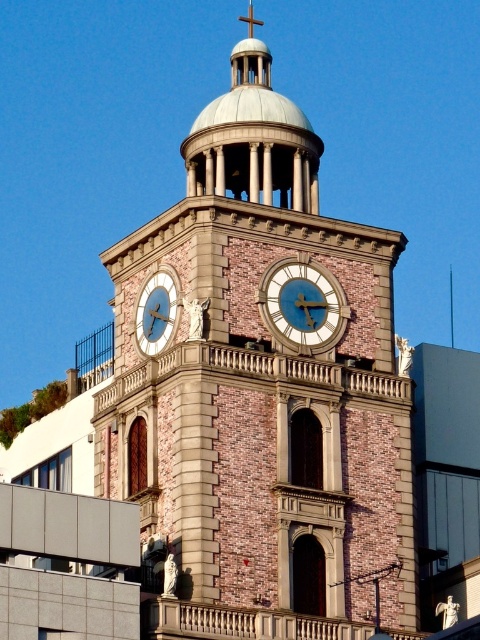
Question: Which point is closer to the camera?

Choices:
 (A) (160, 344)
 (B) (343, 330)
 (C) (120, 243)

Answer: (A)

Question: Is brown brick clock tower at center thinner than matte gold clock at center?

Choices:
 (A) yes
 (B) no

Answer: (B)

Question: Which object is farther from the camera taking this photo?

Choices:
 (A) matte gold clock at center
 (B) brown brick clock tower at center
 (C) blue painted metal clock at center

Answer: (C)

Question: Which object is the farthest from the blue painted metal clock at center?

Choices:
 (A) brown brick clock tower at center
 (B) matte gold clock at center

Answer: (A)

Question: Does blue painted metal clock at center have a smaller size compared to matte gold clock at center?

Choices:
 (A) no
 (B) yes

Answer: (B)

Question: In this image, where is blue painted metal clock at center located relative to matte gold clock at center?

Choices:
 (A) below
 (B) above

Answer: (B)